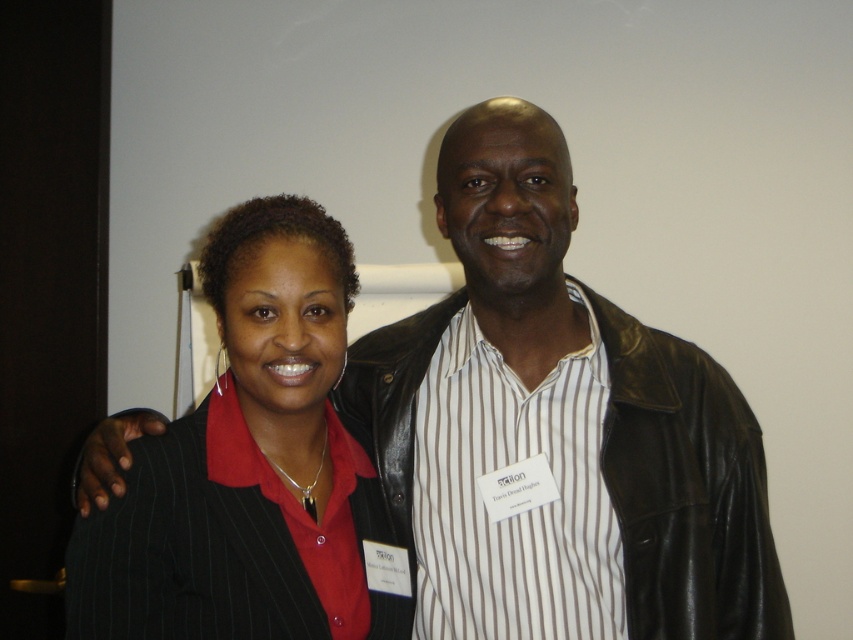
You are a tailor who needs to determine which coat requires more fabric to alter. Based on the image, which one between the black leather jacket at center and the black pinstripe blazer at center needs more fabric for alterations?

The black leather jacket at center requires more fabric for alterations since its width is larger than the black pinstripe blazer at center.